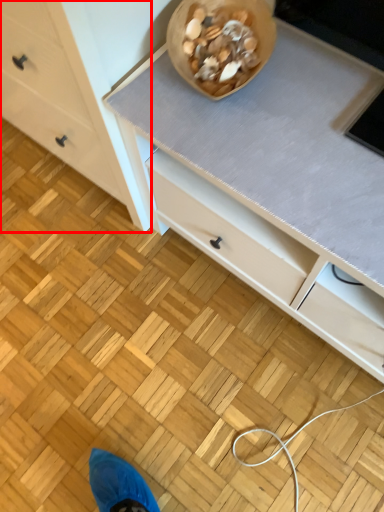
Question: Where is chest of drawers (annotated by the red box) located in relation to food in the image?

Choices:
 (A) left
 (B) right

Answer: (A)